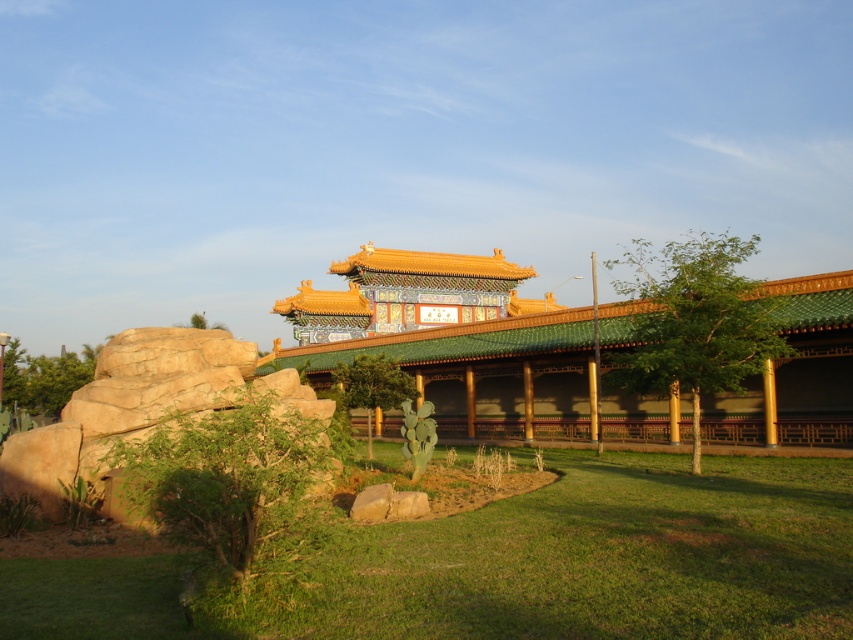
Describe the element at coordinates (228, 481) in the screenshot. I see `green leafy tree at lower left` at that location.

Which of these two, green leafy tree at lower left or green leafy tree at center-right, stands shorter?

green leafy tree at lower left is shorter.

Is point (242, 500) more distant than point (691, 257)?

No, it is in front of (691, 257).

At what (x,y) coordinates should I click in order to perform the action: click on green leafy tree at lower left. Please return your answer as a coordinate pair (x, y). This screenshot has height=640, width=853. Looking at the image, I should click on (228, 481).

Does green grass at lower center have a greater height compared to green leafy tree at center?

Incorrect, green grass at lower center's height is not larger of green leafy tree at center's.

You are a GUI agent. You are given a task and a screenshot of the screen. Output one action in this format:
    pyautogui.click(x=<x>, y=<y>)
    Task: Click on the green grass at lower center
    The image size is (853, 640).
    Given the screenshot: What is the action you would take?
    pyautogui.click(x=602, y=557)

Does green leafy tree at left appear under green leafy tree at center?

Incorrect, green leafy tree at left is not positioned below green leafy tree at center.

Who is more forward, (9, 368) or (351, 392)?

Point (351, 392) is more forward.

Identify the location of green leafy tree at left. (45, 378).